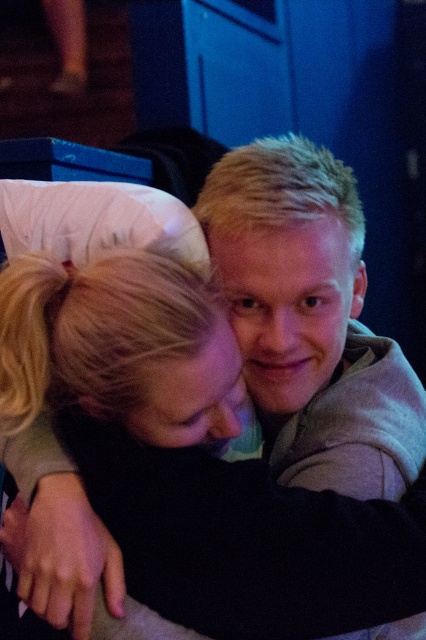
Question: Does gray fleece hoodie at center have a larger size compared to black soft fabric at center?

Choices:
 (A) no
 (B) yes

Answer: (B)

Question: Among these objects, which one is nearest to the camera?

Choices:
 (A) gray fleece hoodie at center
 (B) black soft fabric at center

Answer: (B)

Question: Is gray fleece hoodie at center to the right of black soft fabric at center from the viewer's perspective?

Choices:
 (A) no
 (B) yes

Answer: (B)

Question: Which point appears farthest from the camera in this image?

Choices:
 (A) (423, 451)
 (B) (89, 352)

Answer: (A)

Question: Can you confirm if gray fleece hoodie at center is bigger than black soft fabric at center?

Choices:
 (A) yes
 (B) no

Answer: (A)